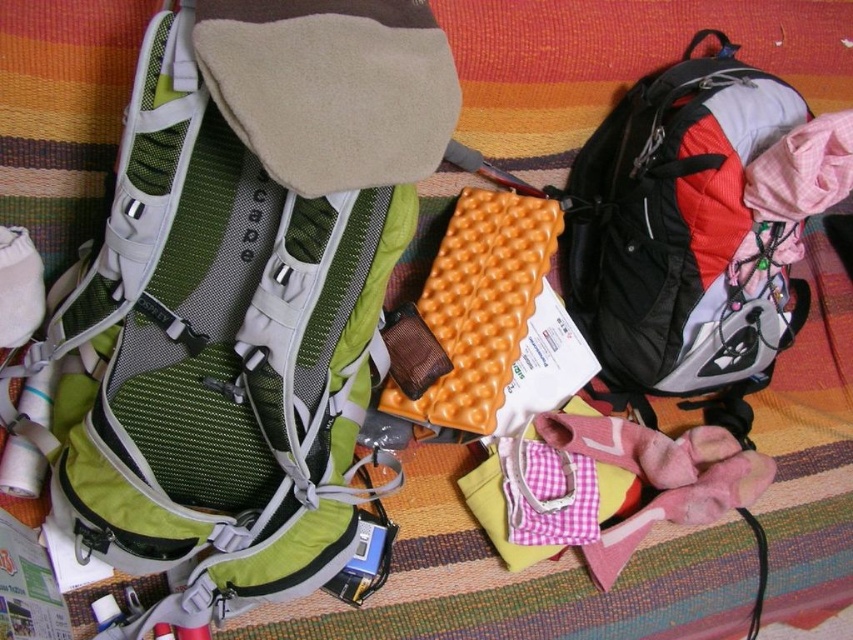
Question: Which point appears farthest from the camera in this image?

Choices:
 (A) (674, 244)
 (B) (86, 401)

Answer: (A)

Question: Among these points, which one is farthest from the camera?

Choices:
 (A) (207, 118)
 (B) (653, 118)

Answer: (B)

Question: Can you confirm if green mesh backpack at upper left is positioned above matte black backpack at right?

Choices:
 (A) no
 (B) yes

Answer: (A)

Question: Can you confirm if green mesh backpack at upper left is wider than matte black backpack at right?

Choices:
 (A) no
 (B) yes

Answer: (B)

Question: Can you confirm if green mesh backpack at upper left is thinner than matte black backpack at right?

Choices:
 (A) yes
 (B) no

Answer: (B)